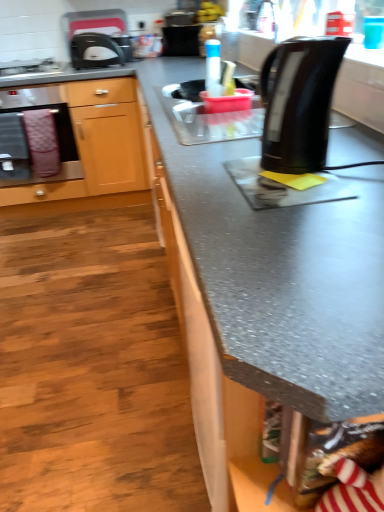
At what (x,y) coordinates should I click in order to perform the action: click on vacant area in front of black glossy electric kettle at right. Please return your answer as a coordinate pair (x, y). The image size is (384, 512). Looking at the image, I should click on (304, 196).